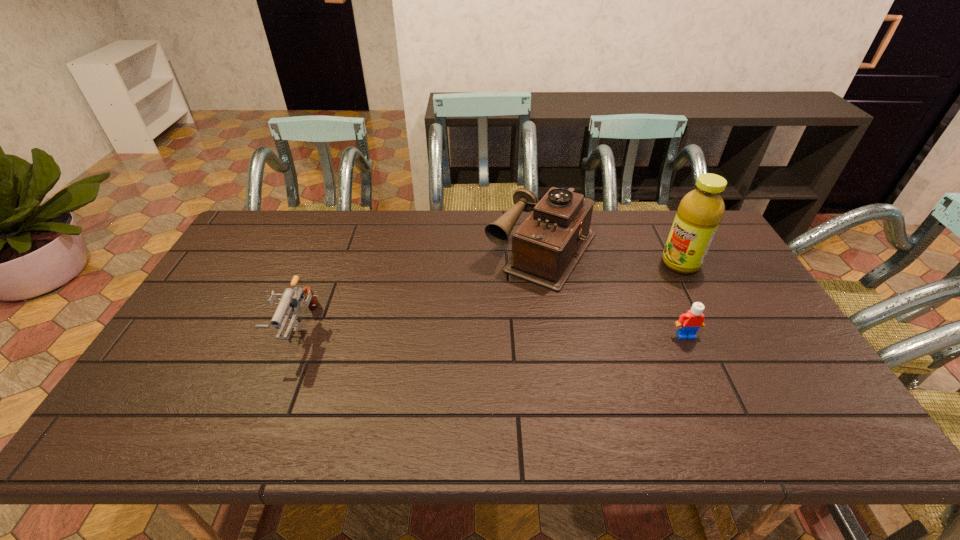
Locate an element on the screen. vacant region located on the horn of the third shortest object is located at coordinates (510, 296).

Locate an element on the screen. vacant space situated 0.320m on the front label of the tallest object is located at coordinates tap(590, 308).

Locate an element on the screen. This screenshot has width=960, height=540. free space located on the front label of the tallest object is located at coordinates (615, 295).

Locate an element on the screen. vacant point located on the front label of the tallest object is located at coordinates (590, 308).

You are a GUI agent. You are given a task and a screenshot of the screen. Output one action in this format:
    pyautogui.click(x=<x>, y=<y>)
    Task: Click on the object that is at the far edge
    This screenshot has height=540, width=960.
    Given the screenshot: What is the action you would take?
    pyautogui.click(x=547, y=246)

The height and width of the screenshot is (540, 960). I want to click on object located in the right edge section of the desktop, so [x=700, y=211].

In the image, there is a desktop. Where is `vacant space at the far edge`? This screenshot has height=540, width=960. vacant space at the far edge is located at coordinates (407, 221).

The height and width of the screenshot is (540, 960). In the image, there is a desktop. Find the location of `free space at the near edge`. free space at the near edge is located at coordinates (737, 375).

Where is `free location at the left edge of the desktop`? free location at the left edge of the desktop is located at coordinates (215, 300).

Find the location of a particular element. Image resolution: width=960 pixels, height=540 pixels. vacant area that lies between the phonograph_record and the leftmost object is located at coordinates (420, 291).